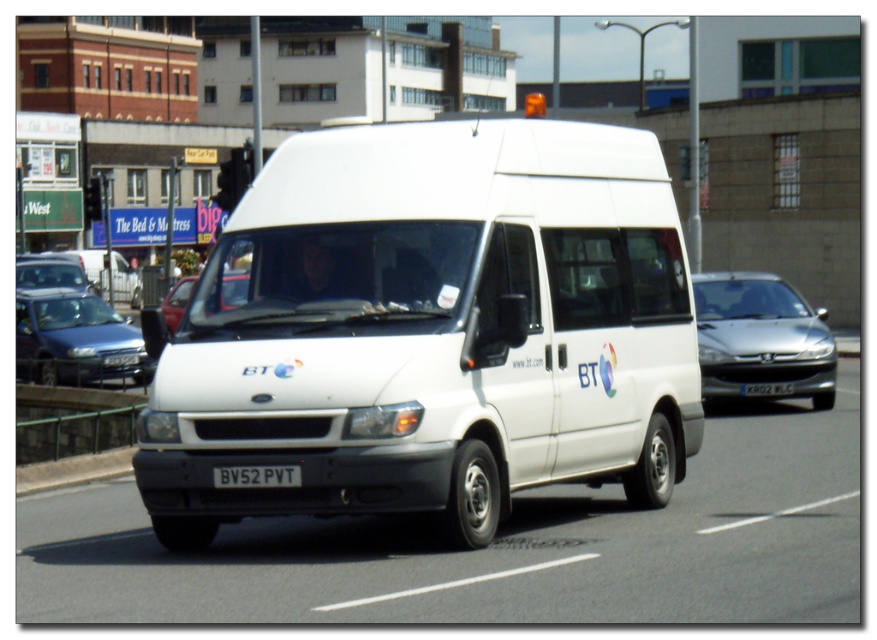
Question: Which object appears closest to the camera in this image?

Choices:
 (A) matte silver car at left
 (B) metallic blue sedan at left
 (C) black plastic license plate at center

Answer: (C)

Question: In this image, where is white matte van at center located relative to matte silver car at left?

Choices:
 (A) left
 (B) right

Answer: (B)

Question: Which object is closer to the camera taking this photo?

Choices:
 (A) matte silver car at left
 (B) matte red car at center
 (C) silver metallic sedan at right
 (D) black plastic license plate at center

Answer: (D)

Question: Which is farther from the white matte van at center?

Choices:
 (A) black plastic license plate at center
 (B) silver metallic sedan at right
 (C) matte silver car at left
 (D) matte red car at center

Answer: (C)

Question: From the image, what is the correct spatial relationship of metallic blue sedan at left in relation to black plastic license plate at center?

Choices:
 (A) above
 (B) below

Answer: (A)

Question: Is black plastic license plate at center smaller than white plastic license plate at center?

Choices:
 (A) yes
 (B) no

Answer: (B)